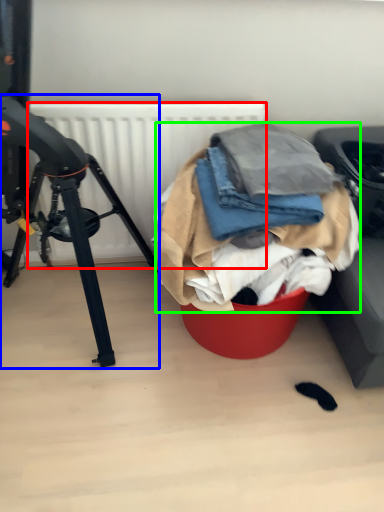
Question: Estimate the real-world distances between objects in this image. Which object is closer to radiator (highlighted by a red box), tripod (highlighted by a blue box) or clothing (highlighted by a green box)?

Choices:
 (A) tripod
 (B) clothing

Answer: (A)